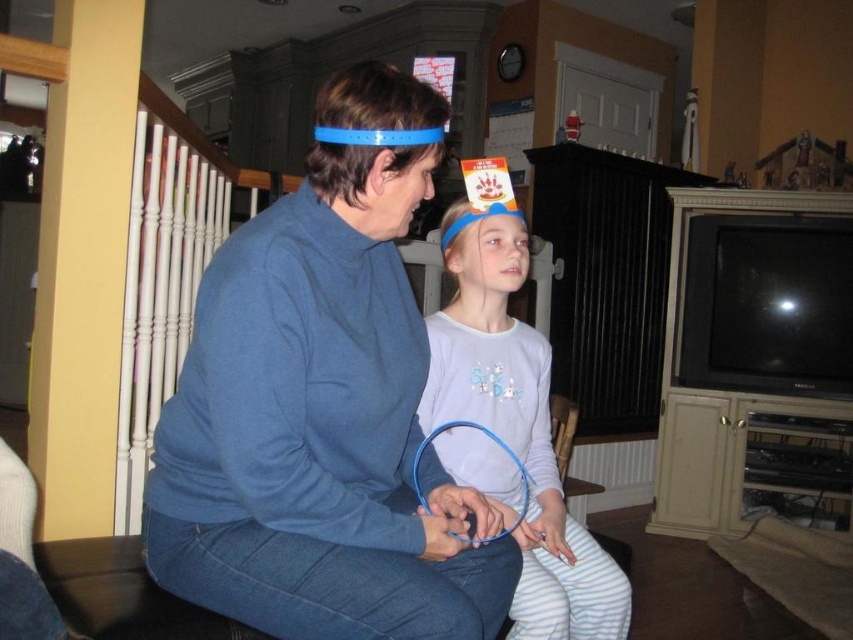
Is matte blue sweater at center wider than white cotton shirt at center?

Correct, the width of matte blue sweater at center exceeds that of white cotton shirt at center.

Is matte blue sweater at center closer to camera compared to white cotton shirt at center?

Yes, it is in front of white cotton shirt at center.

Does point (236, 557) come in front of point (566, 573)?

Yes, it is.

The width and height of the screenshot is (853, 640). I want to click on matte blue sweater at center, so pyautogui.click(x=318, y=428).